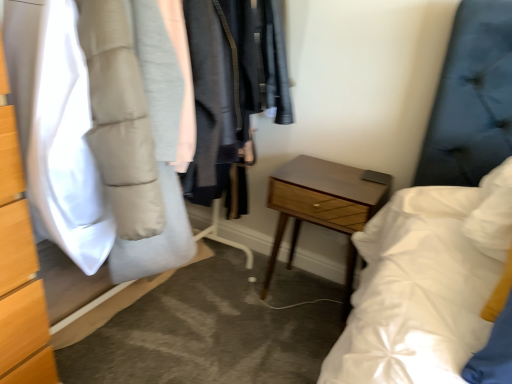
This screenshot has width=512, height=384. What do you see at coordinates (324, 206) in the screenshot? I see `woodenmaterial/texturenightstand at center` at bounding box center [324, 206].

This screenshot has height=384, width=512. In order to click on white matte puffer jacket at left in this screenshot , I will do `click(56, 128)`.

Find the location of a particular element. The image size is (512, 384). woodenmaterial/texturenightstand at center is located at coordinates (324, 206).

Does white matte puffer jacket at left have a greater height compared to woodenmaterial/texturenightstand at center?

Yes.

Considering the relative sizes of white matte puffer jacket at left and woodenmaterial/texturenightstand at center in the image provided, is white matte puffer jacket at left wider than woodenmaterial/texturenightstand at center?

Indeed, white matte puffer jacket at left has a greater width compared to woodenmaterial/texturenightstand at center.

Considering the positions of point (89, 274) and point (351, 204), is point (89, 274) closer or farther from the camera than point (351, 204)?

Point (89, 274) appears to be closer to the viewer than point (351, 204).

Is white matte puffer jacket at left positioned beyond the bounds of woodenmaterial/texturenightstand at center?

Indeed, white matte puffer jacket at left is completely outside woodenmaterial/texturenightstand at center.

Considering the relative sizes of woodenmaterial/texturenightstand at center and matte gray puffer jacket at left in the image provided, is woodenmaterial/texturenightstand at center wider than matte gray puffer jacket at left?

In fact, woodenmaterial/texturenightstand at center might be narrower than matte gray puffer jacket at left.

Measure the distance from woodenmaterial/texturenightstand at center to matte gray puffer jacket at left.

woodenmaterial/texturenightstand at center and matte gray puffer jacket at left are 23.34 inches apart from each other.

Is woodenmaterial/texturenightstand at center not inside matte gray puffer jacket at left?

Yes, woodenmaterial/texturenightstand at center is located beyond the bounds of matte gray puffer jacket at left.

Is point (343, 213) positioned behind point (127, 80)?

Yes, it is behind point (127, 80).

From a real-world perspective, is woodenmaterial/texturenightstand at center on white matte puffer jacket at left?

No, from a real-world perspective, woodenmaterial/texturenightstand at center is not on top of white matte puffer jacket at left.

From the image's perspective, is woodenmaterial/texturenightstand at center over white matte puffer jacket at left?

Incorrect, from the image's perspective, woodenmaterial/texturenightstand at center is lower than white matte puffer jacket at left.

In the scene shown: Between woodenmaterial/texturenightstand at center and white matte puffer jacket at left, which one has smaller width?

woodenmaterial/texturenightstand at center is thinner.

The image size is (512, 384). Identify the location of nightstand located underneath the white matte puffer jacket at left (from a real-world perspective). (324, 206).

From the picture: Is white matte puffer jacket at left bigger than matte gray puffer jacket at left?

No, white matte puffer jacket at left is not bigger than matte gray puffer jacket at left.

Looking at this image, is white matte puffer jacket at left turned away from matte gray puffer jacket at left?

Absolutely, white matte puffer jacket at left is directed away from matte gray puffer jacket at left.

Is white matte puffer jacket at left beside matte gray puffer jacket at left?

There is a gap between white matte puffer jacket at left and matte gray puffer jacket at left.

From a real-world perspective, does matte gray puffer jacket at left sit lower than white matte puffer jacket at left?

Yes, from a real-world perspective, matte gray puffer jacket at left is beneath white matte puffer jacket at left.

Does matte gray puffer jacket at left have a larger size compared to white matte puffer jacket at left?

Indeed, matte gray puffer jacket at left has a larger size compared to white matte puffer jacket at left.

From the image's perspective, which object appears higher, matte gray puffer jacket at left or white matte puffer jacket at left?

white matte puffer jacket at left.

Are matte gray puffer jacket at left and woodenmaterial/texturenightstand at center far apart?

No, matte gray puffer jacket at left is not far from woodenmaterial/texturenightstand at center.

Can you tell me how much matte gray puffer jacket at left and woodenmaterial/texturenightstand at center differ in facing direction?

89.3 degrees separate the facing orientations of matte gray puffer jacket at left and woodenmaterial/texturenightstand at center.

From a real-world perspective, is matte gray puffer jacket at left above or below woodenmaterial/texturenightstand at center?

matte gray puffer jacket at left is situated higher than woodenmaterial/texturenightstand at center in the real world.

Does matte gray puffer jacket at left have a greater width compared to woodenmaterial/texturenightstand at center?

Indeed, matte gray puffer jacket at left has a greater width compared to woodenmaterial/texturenightstand at center.

Where is `clothing on the left of woodenmaterial/texturenightstand at center`? This screenshot has width=512, height=384. clothing on the left of woodenmaterial/texturenightstand at center is located at coordinates (56, 128).

Identify the location of nightstand to the right of matte gray puffer jacket at left. The width and height of the screenshot is (512, 384). (324, 206).

From the image, which object appears to be nearer to matte gray puffer jacket at left, white matte puffer jacket at left or woodenmaterial/texturenightstand at center?

white matte puffer jacket at left.

Consider the image. Which object lies further to the anchor point woodenmaterial/texturenightstand at center, matte gray puffer jacket at left or white matte puffer jacket at left?

Among the two, white matte puffer jacket at left is located further to woodenmaterial/texturenightstand at center.

Considering their positions, is white matte puffer jacket at left positioned further to woodenmaterial/texturenightstand at center than matte gray puffer jacket at left?

white matte puffer jacket at left is further to woodenmaterial/texturenightstand at center.

When comparing their distances from white matte puffer jacket at left, does woodenmaterial/texturenightstand at center or matte gray puffer jacket at left seem further?

woodenmaterial/texturenightstand at center is positioned further to the anchor white matte puffer jacket at left.

Estimate the real-world distances between objects in this image. Which object is further from white matte puffer jacket at left, matte gray puffer jacket at left or woodenmaterial/texturenightstand at center?

The object further to white matte puffer jacket at left is woodenmaterial/texturenightstand at center.

Based on their spatial positions, is woodenmaterial/texturenightstand at center or white matte puffer jacket at left closer to matte gray puffer jacket at left?

white matte puffer jacket at left is positioned closer to the anchor matte gray puffer jacket at left.

Identify the location of closet located between white matte puffer jacket at left and woodenmaterial/texturenightstand at center in the left-right direction. The image size is (512, 384). (100, 130).